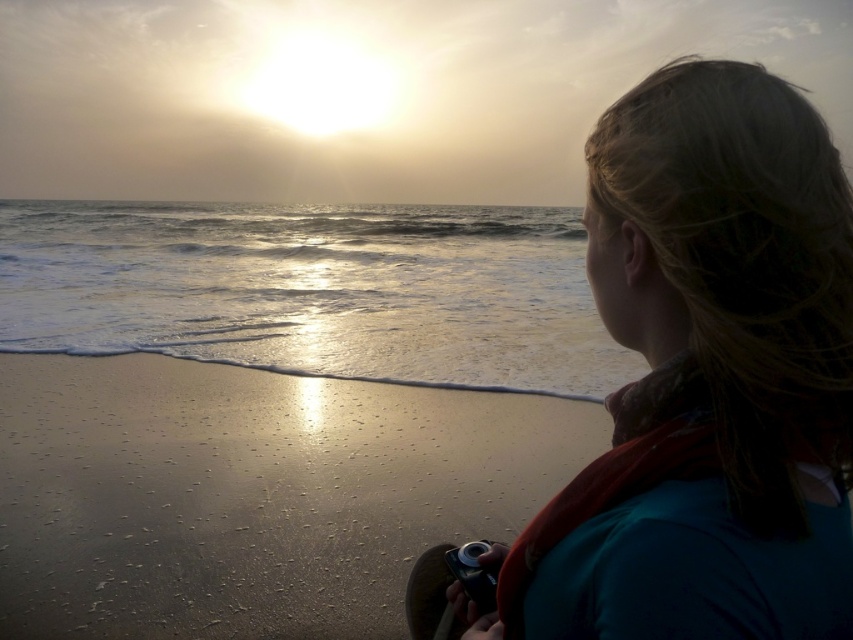
Between teal fabric shirt at center and black plastic camera at lower center, which one has more height?

Standing taller between the two is teal fabric shirt at center.

Between point (753, 461) and point (468, 582), which one is positioned in front?

Point (753, 461) is more forward.

The height and width of the screenshot is (640, 853). What do you see at coordinates (715, 365) in the screenshot? I see `teal fabric shirt at center` at bounding box center [715, 365].

The height and width of the screenshot is (640, 853). I want to click on teal fabric shirt at center, so click(x=715, y=365).

Is point (549, 604) positioned before point (338, 483)?

Yes, point (549, 604) is closer to viewer.

Based on the photo, who is more distant from viewer, (842,396) or (260,513)?

Point (260,513)

At what (x,y) coordinates should I click in order to perform the action: click on teal fabric shirt at center. Please return your answer as a coordinate pair (x, y). The image size is (853, 640). Looking at the image, I should click on (715, 365).

Who is more distant from viewer, (x=183, y=602) or (x=461, y=579)?

The point (x=183, y=602) is more distant.

Is point (120, 499) behind point (492, 579)?

That is True.

Locate an element on the screen. This screenshot has height=640, width=853. sandy beach at lower left is located at coordinates (250, 493).